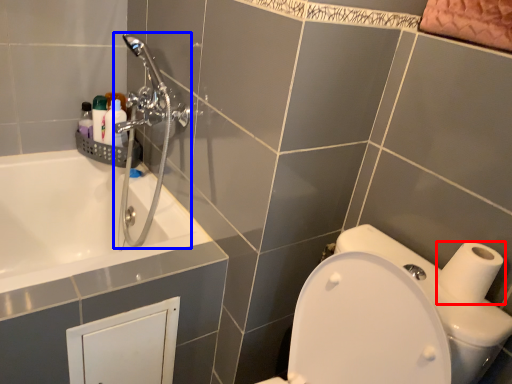
Question: Which of the following is the farthest to the observer, toilet paper (highlighted by a red box) or shower (highlighted by a blue box)?

Choices:
 (A) toilet paper
 (B) shower

Answer: (B)